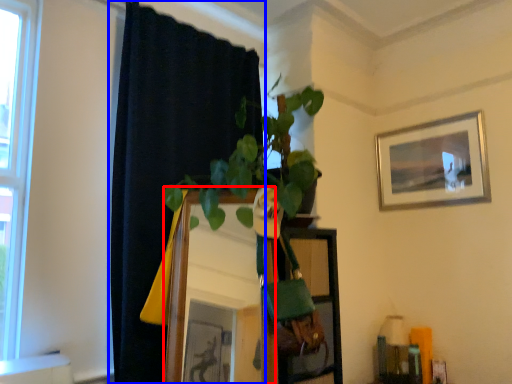
Question: Which of the following is the closest to the observer, mirror (highlighted by a red box) or curtain (highlighted by a blue box)?

Choices:
 (A) mirror
 (B) curtain

Answer: (A)